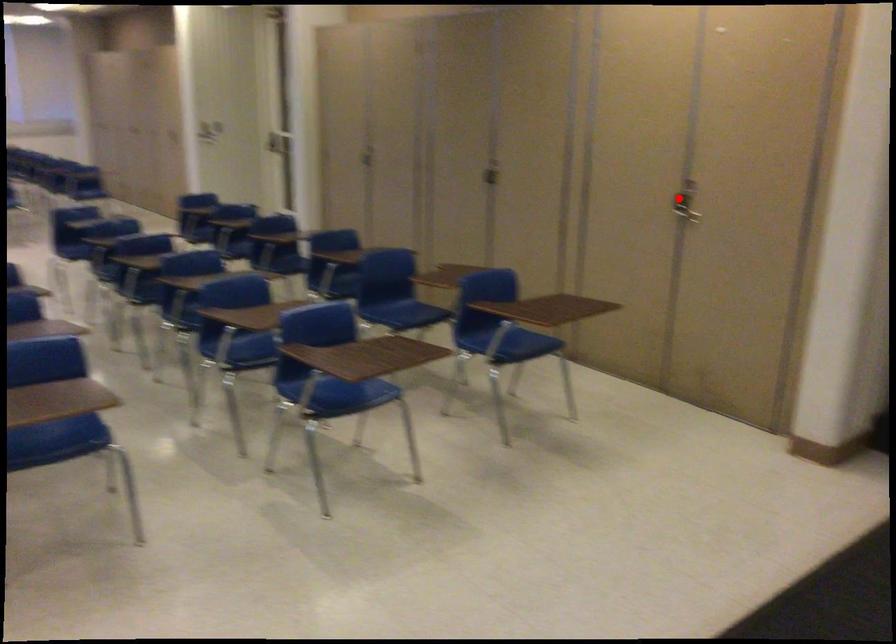
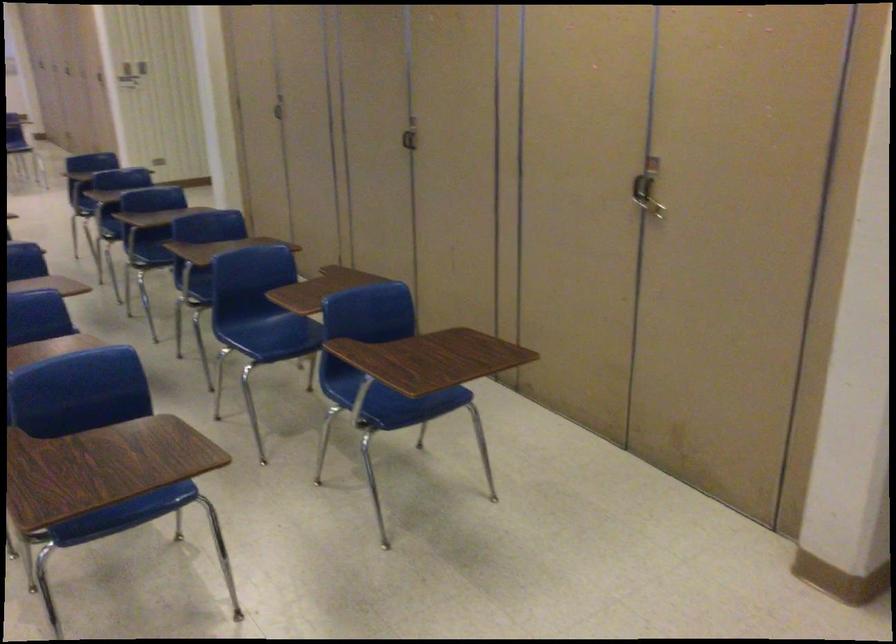
Question: I am providing you with two images of the same scene from different viewpoints. A red point is marked on the first image. Can you still see the location of the red point in image 2?

Choices:
 (A) Yes
 (B) No

Answer: (A)